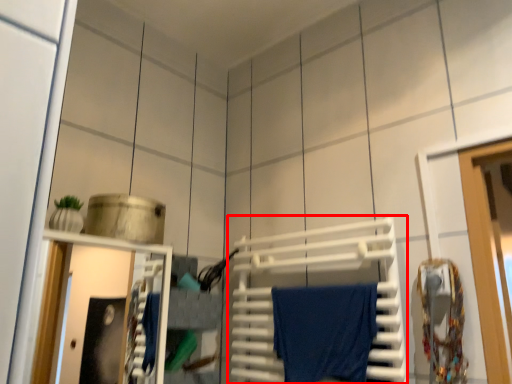
Question: From the image's perspective, what is the correct spatial relationship of wide (annotated by the red box) in relation to bath towel?

Choices:
 (A) above
 (B) below

Answer: (A)